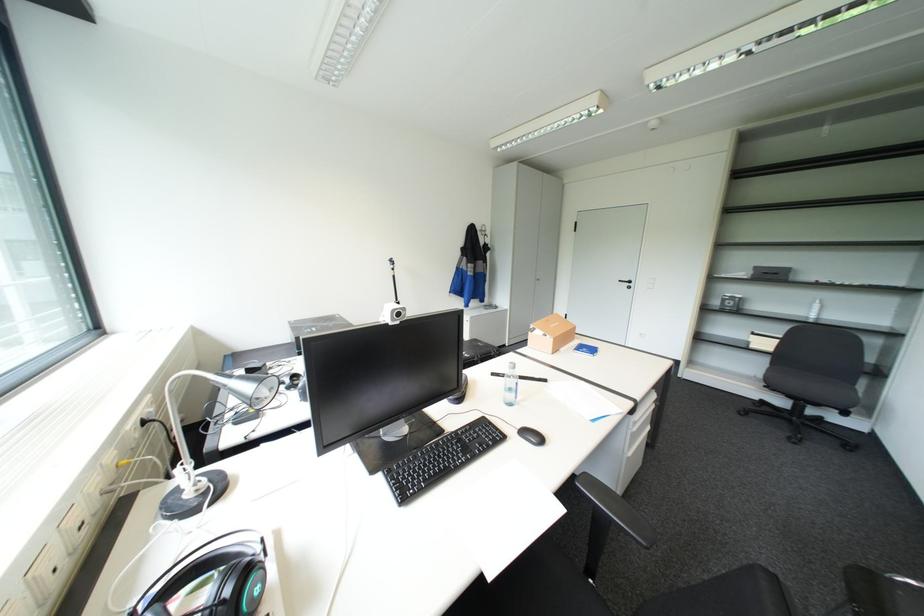
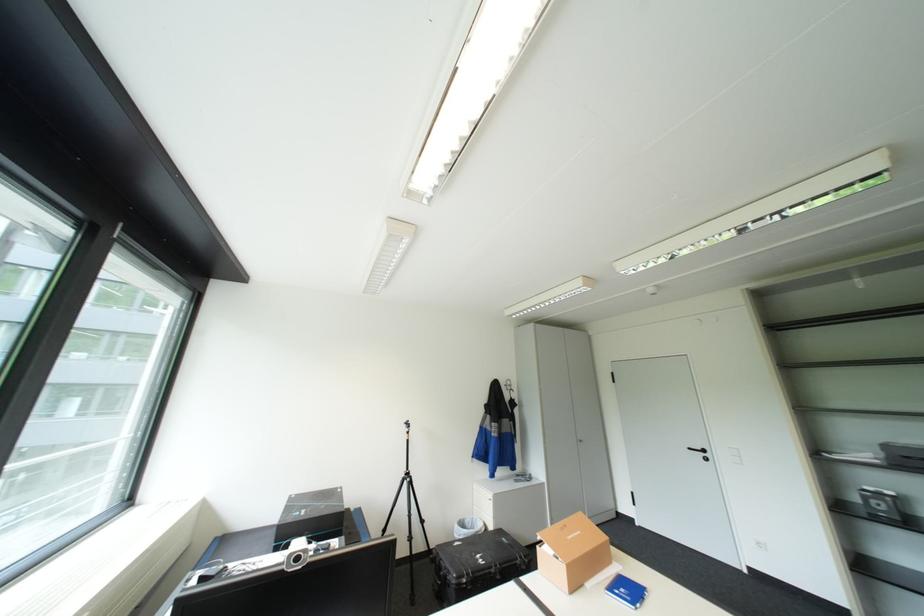
The point at (657, 120) is marked in the first image. Where is the corresponding point in the second image?

(653, 286)